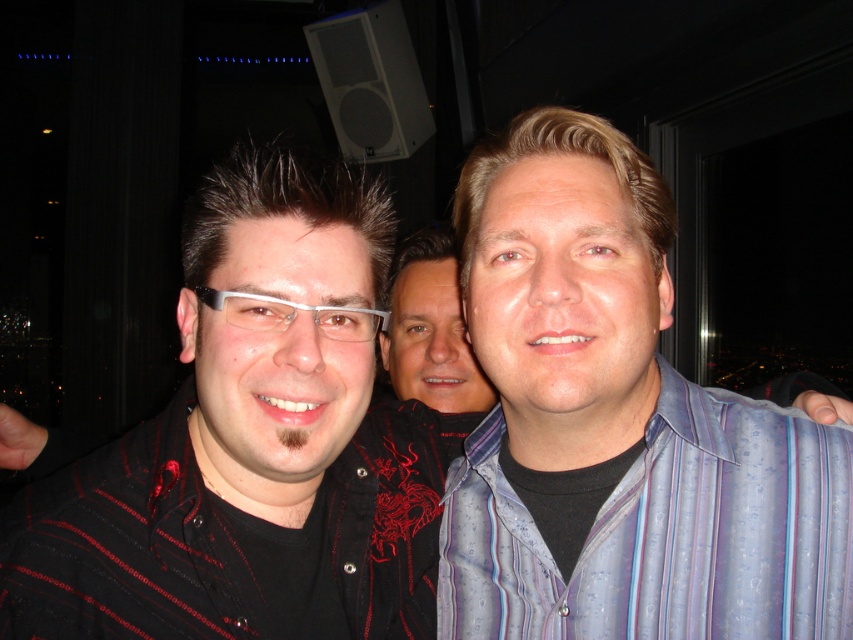
Question: Which object is the closest to the white plastic glasses at center?

Choices:
 (A) striped cotton shirt at right
 (B) smooth black shirt at center

Answer: (A)

Question: Does smooth black shirt at center lie behind white plastic glasses at center?

Choices:
 (A) yes
 (B) no

Answer: (A)

Question: Which is farther from the white plastic glasses at center?

Choices:
 (A) striped cotton shirt at right
 (B) smooth black shirt at center

Answer: (B)

Question: Can you confirm if smooth black shirt at center is positioned to the left of white plastic glasses at center?

Choices:
 (A) no
 (B) yes

Answer: (A)

Question: Among these points, which one is farthest from the camera?

Choices:
 (A) (409, 385)
 (B) (463, 515)

Answer: (A)

Question: From the image, what is the correct spatial relationship of smooth black shirt at center in relation to white plastic glasses at center?

Choices:
 (A) above
 (B) below

Answer: (B)